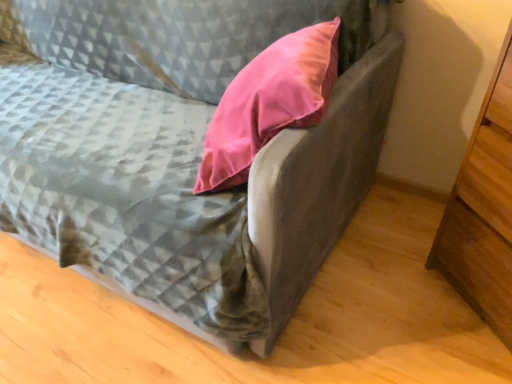
At what (x,y) coordinates should I click in order to perform the action: click on velvet pink pillow at upper center. Please return your answer as a coordinate pair (x, y). The image size is (512, 384). Looking at the image, I should click on (184, 151).

Describe the element at coordinates (184, 151) in the screenshot. Image resolution: width=512 pixels, height=384 pixels. I see `velvet pink pillow at upper center` at that location.

Find the location of a particular element. The image size is (512, 384). velvet pink pillow at upper center is located at coordinates (184, 151).